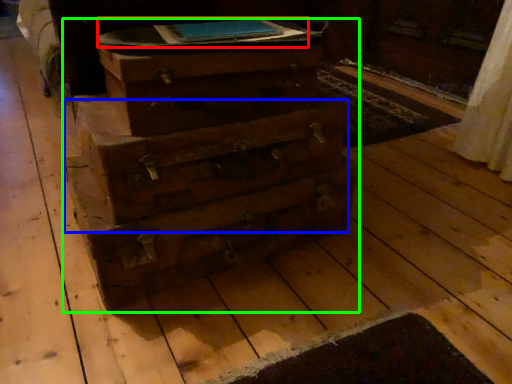
Question: Which is farther away from book (highlighted by a red box)? drawer (highlighted by a blue box) or chest of drawers (highlighted by a green box)?

Choices:
 (A) drawer
 (B) chest of drawers

Answer: (A)